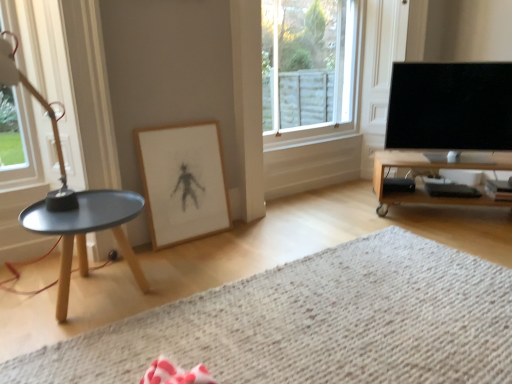
Find the location of a particular element. This screenshot has width=512, height=384. free space to the left of wooden tv stand at right is located at coordinates (352, 219).